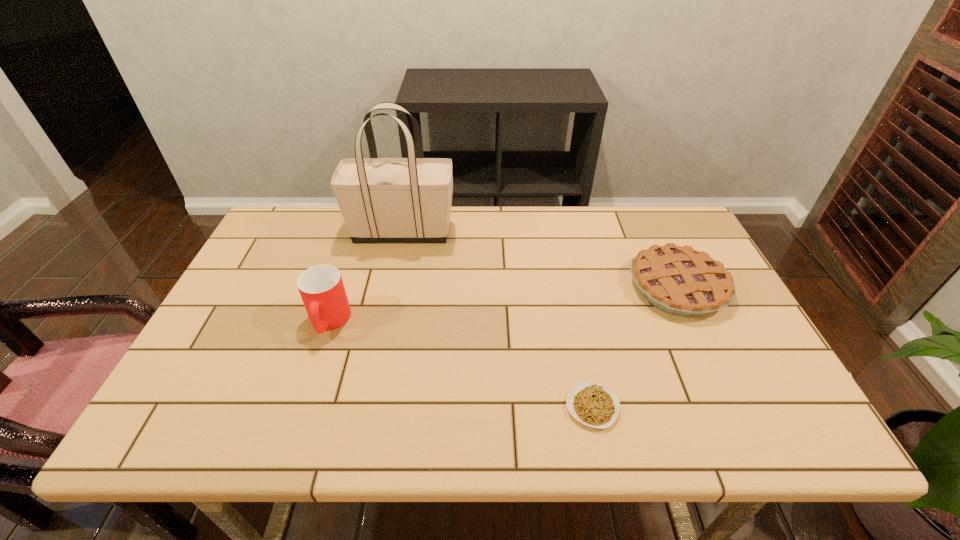
The width and height of the screenshot is (960, 540). What are the coordinates of `free space in the image that satisfies the following two spatial constraints: 1. with handles facing forward on the farthest object; 2. on the right side of the rightmost object` in the screenshot? It's located at (391, 287).

Where is `vacant space that satisfies the following two spatial constraints: 1. with handles facing forward on the nearest object; 2. on the left side of the shopping bag`? vacant space that satisfies the following two spatial constraints: 1. with handles facing forward on the nearest object; 2. on the left side of the shopping bag is located at coordinates (365, 407).

The width and height of the screenshot is (960, 540). I want to click on vacant space that satisfies the following two spatial constraints: 1. on the side of the second object from right to left with the handle; 2. on the left side of the cup, so click(300, 407).